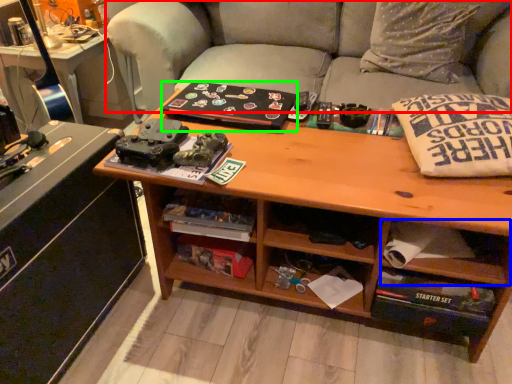
Question: Based on their relative distances, which object is nearer to studio couch (highlighted by a red box)? Choose from drawer (highlighted by a blue box) and book (highlighted by a green box).

Choices:
 (A) drawer
 (B) book

Answer: (B)